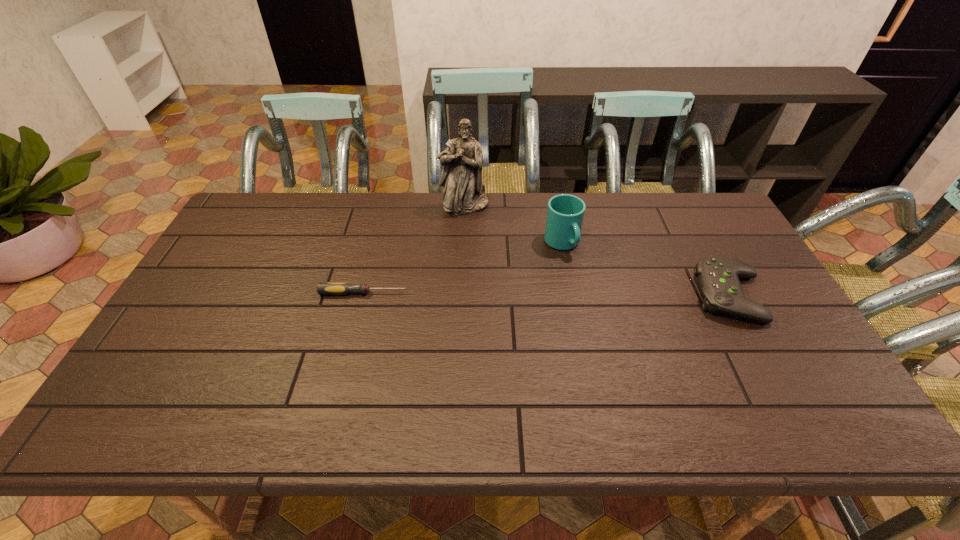
At what (x,y) coordinates should I click in order to perform the action: click on the shortest object. Please return your answer as a coordinate pair (x, y). Looking at the image, I should click on (323, 288).

This screenshot has width=960, height=540. What are the coordinates of `screwdriver` in the screenshot? It's located at (323, 288).

Locate an element on the screen. the second shortest object is located at coordinates (718, 277).

The image size is (960, 540). I want to click on control, so click(x=718, y=277).

Find the location of a particular element. cup is located at coordinates (565, 213).

At what (x,y) coordinates should I click in order to perform the action: click on the third nearest object. Please return your answer as a coordinate pair (x, y). This screenshot has width=960, height=540. Looking at the image, I should click on (565, 213).

Where is `the farthest object`? the farthest object is located at coordinates (461, 175).

Identify the location of figurine. (461, 175).

Locate an element on the screen. This screenshot has height=540, width=960. blank space located 0.220m insert the leftmost object into a screw head is located at coordinates (486, 293).

At what (x,y) coordinates should I click in order to perform the action: click on free space located on the left of the second shortest object. Please return your answer as a coordinate pair (x, y). Looking at the image, I should click on (552, 295).